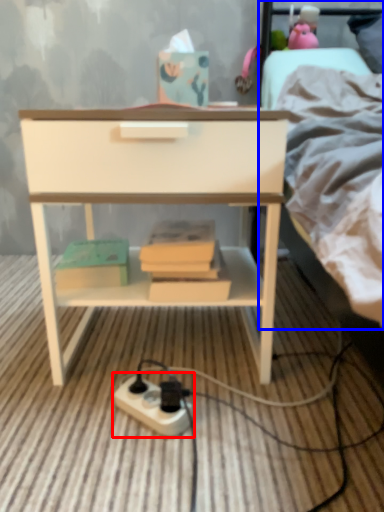
Question: Which object is closer to the camera taking this photo, power plugs and sockets (highlighted by a red box) or bed (highlighted by a blue box)?

Choices:
 (A) power plugs and sockets
 (B) bed

Answer: (A)